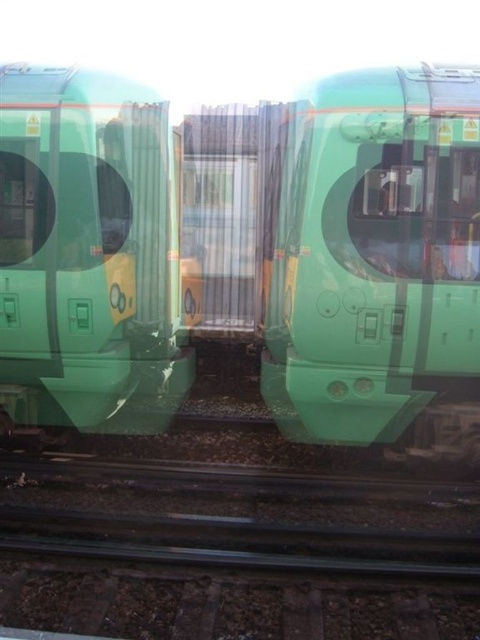
You are standing in front of two green train carriages positioned side by side on railway tracks. You notice two points labeled point (43, 620) and point (104, 298). Which point is nearer to you?

Point (43, 620) is closer to the viewer than point (104, 298).

You are a passenger standing on the platform waiting for the train. You see the green matte train at center and the black metal train track at center. Which object is closer to you?

The green matte train at center is closer to you because the black metal train track at center is behind it.